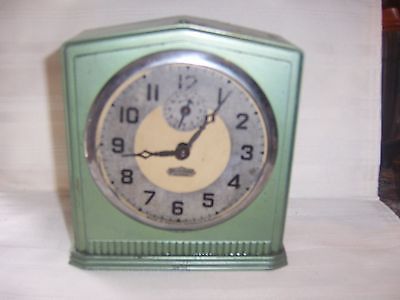
Identify the location of face of clock. This screenshot has height=300, width=400. pyautogui.click(x=165, y=134).